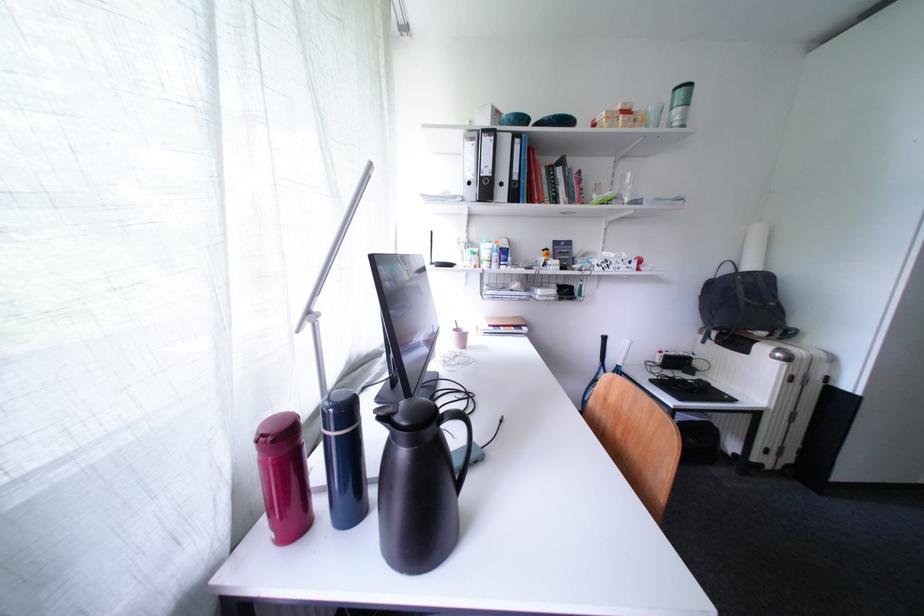
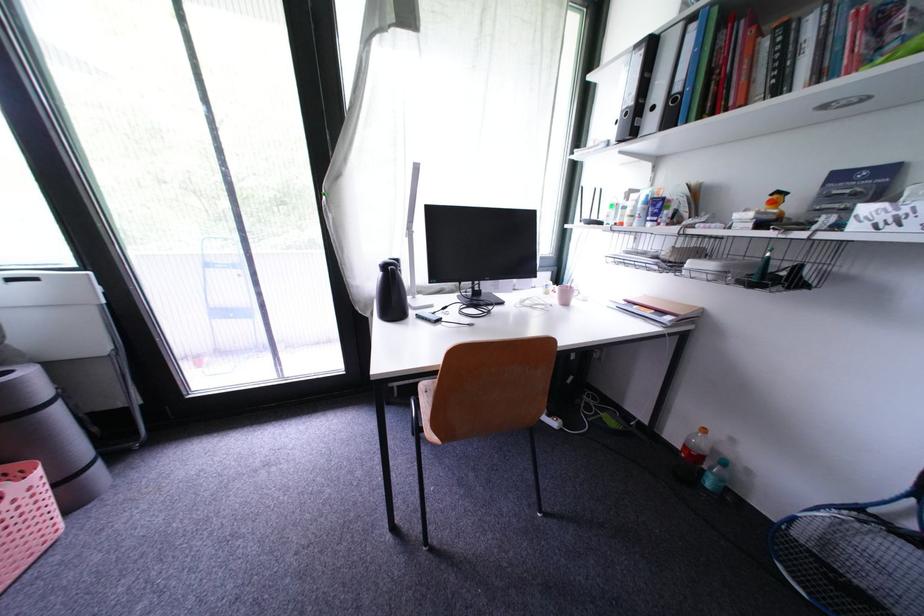
Where in the second image is the point corresponding to (x=500, y=140) from the first image?

(650, 54)